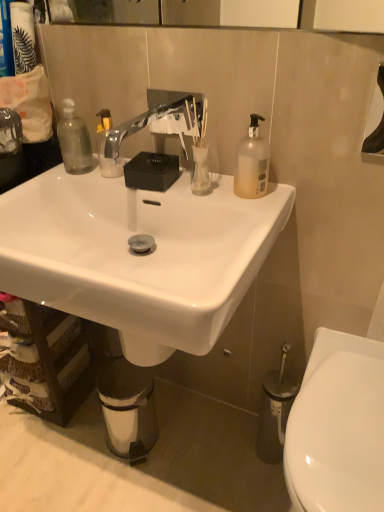
Locate an element on the screen. This screenshot has width=384, height=512. empty space that is to the right of metallic silver trash can at lower center is located at coordinates 187,435.